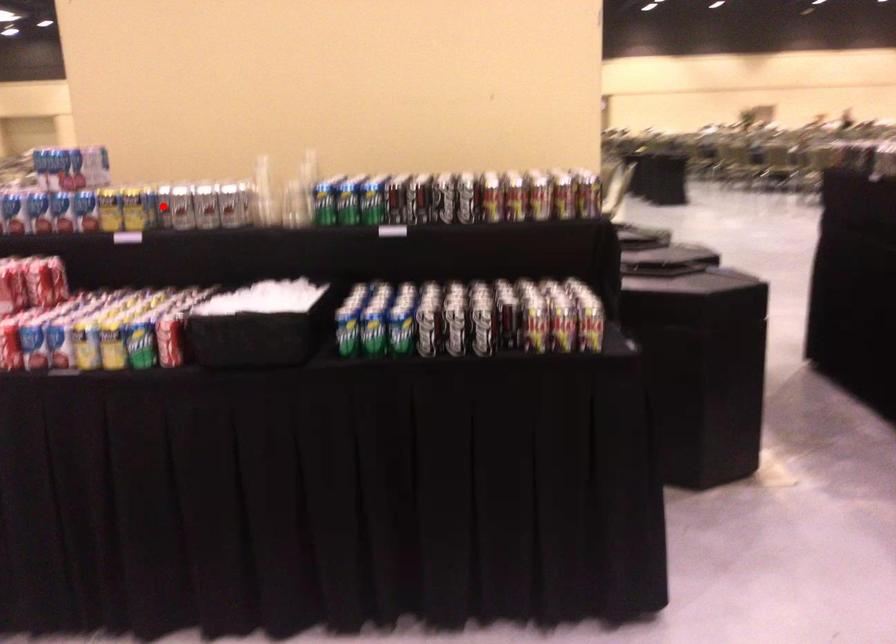
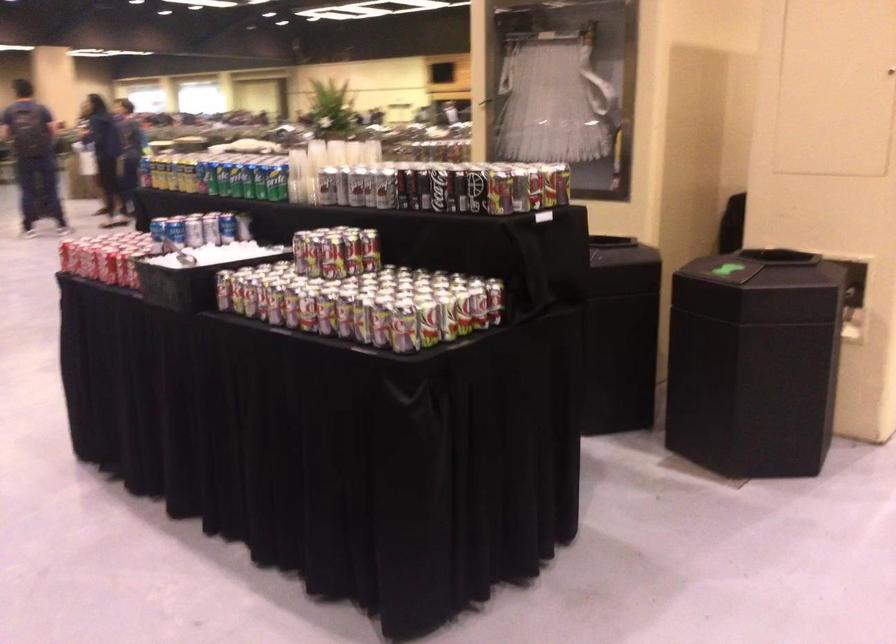
Question: I am providing you with two images of the same scene from different viewpoints. A red point is marked on the first image. Can you still see the location of the red point in image 2?

Choices:
 (A) Yes
 (B) No

Answer: (B)